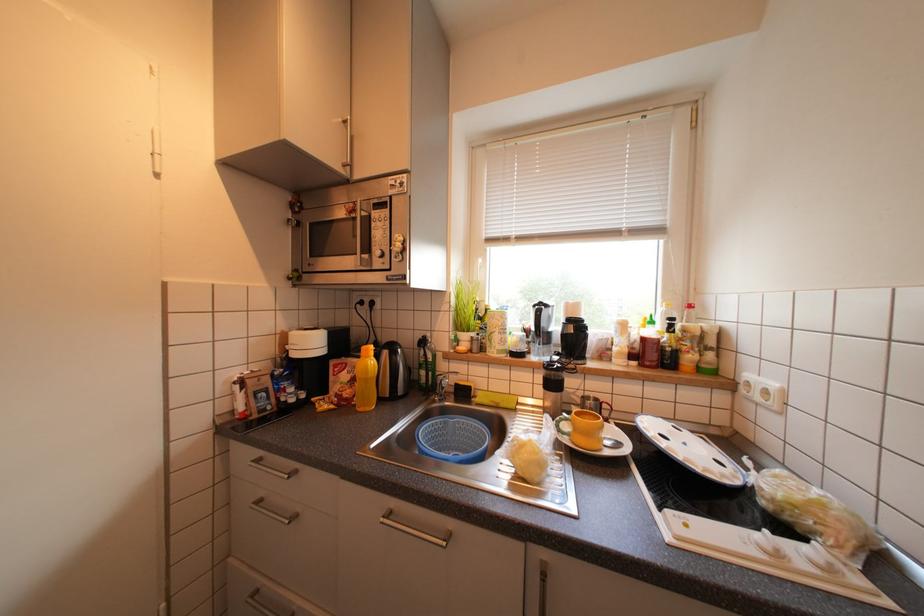
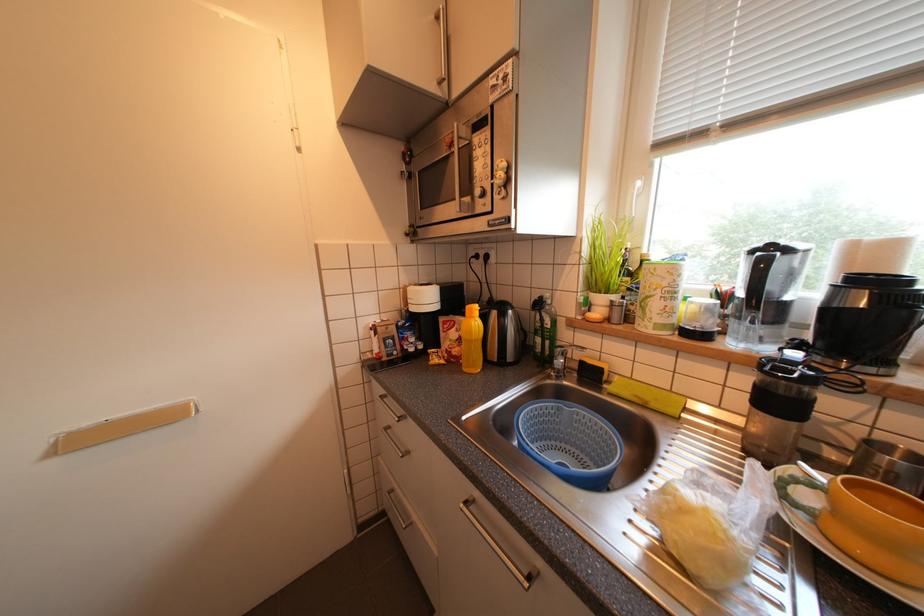
Question: The first image is from the beginning of the video and the second image is from the end. How did the camera likely rotate when shooting the video?

Choices:
 (A) Left
 (B) Right
 (C) Up
 (D) Down

Answer: (A)